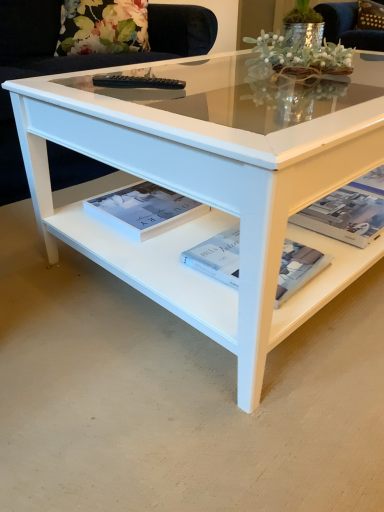
Where is `empty space that is ontop of white glossy magazine at lower right, the 1th magazine from the right`? This screenshot has height=512, width=384. empty space that is ontop of white glossy magazine at lower right, the 1th magazine from the right is located at coordinates pos(345,207).